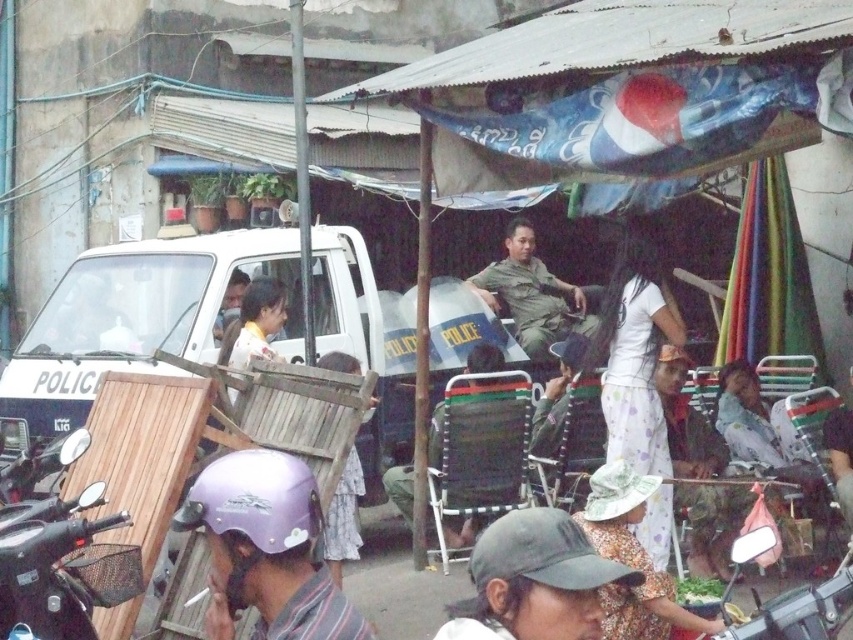
Question: Which object is farther from the camera taking this photo?

Choices:
 (A) wooden chair at center
 (B) camouflage fabric uniform at center
 (C) dark gray fabric cap at lower center
 (D) purple matte helmet at lower left

Answer: (B)

Question: Which of the following is the closest to the observer?

Choices:
 (A) purple matte helmet at lower left
 (B) camouflage fabric uniform at center
 (C) wooden chair at center

Answer: (A)

Question: Is purple matte helmet at lower left closer to camera compared to camouflage fabric uniform at center?

Choices:
 (A) yes
 (B) no

Answer: (A)

Question: Which object appears farthest from the camera in this image?

Choices:
 (A) camouflage fabric uniform at center
 (B) dark gray fabric cap at lower center

Answer: (A)

Question: Does dark gray fabric cap at lower center appear over light brown wooden chair at center?

Choices:
 (A) yes
 (B) no

Answer: (B)

Question: Is wooden chair at center positioned before light brown wooden chair at center?

Choices:
 (A) yes
 (B) no

Answer: (A)